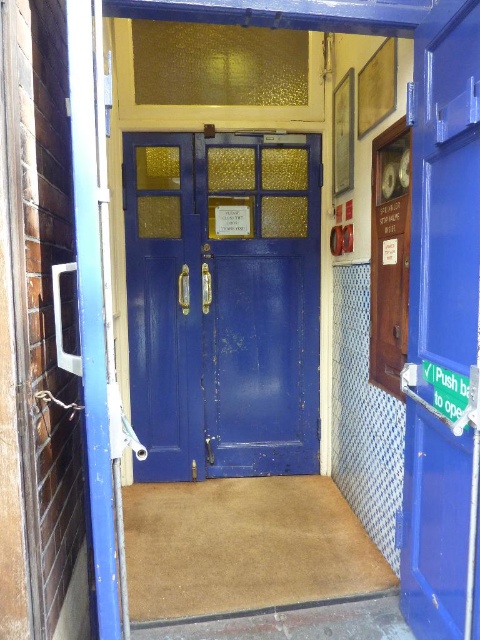
Which is above, matte blue door at center or matte blue door at right?

matte blue door at center

In the scene shown: Does matte blue door at center come in front of matte blue door at right?

No, matte blue door at center is behind matte blue door at right.

Identify the location of matte blue door at center. This screenshot has width=480, height=640. (223, 301).

Where is `matte blue door at center`? This screenshot has height=640, width=480. matte blue door at center is located at coordinates 223,301.